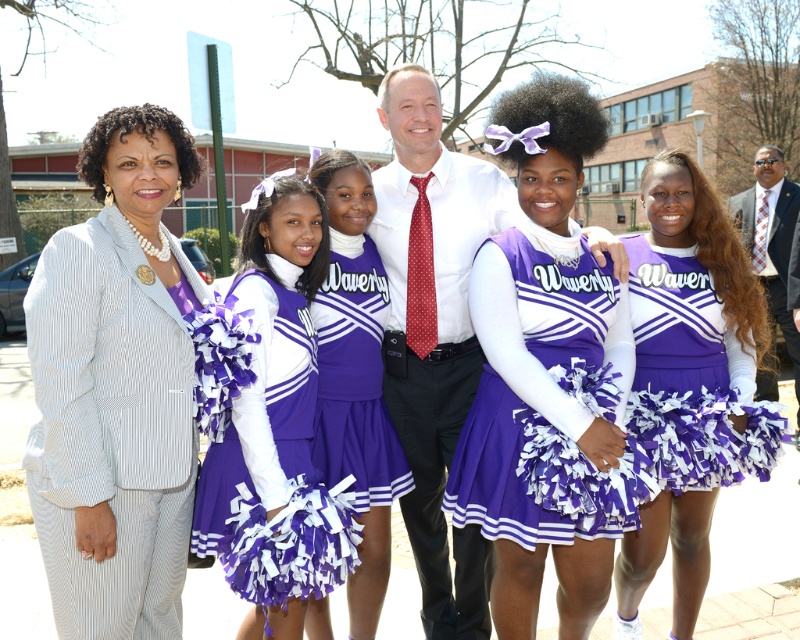
Question: Among these objects, which one is nearest to the camera?

Choices:
 (A) purple satin cheerleader at center
 (B) purple satin cheerleading outfit at center
 (C) purple fabric pom-poms at center
 (D) polished white shirt at center

Answer: (C)

Question: Which point is farther to the camera?

Choices:
 (A) (396, 294)
 (B) (308, 616)

Answer: (A)

Question: Does polished white shirt at center appear over polished wood tie at right?

Choices:
 (A) yes
 (B) no

Answer: (B)

Question: Among these points, which one is nearest to the camera?

Choices:
 (A) (300, 269)
 (B) (796, 332)

Answer: (A)

Question: Is polished white shirt at center bigger than purple satin cheerleader at center?

Choices:
 (A) yes
 (B) no

Answer: (A)

Question: Is the position of polished white shirt at center more distant than that of polished wood tie at right?

Choices:
 (A) yes
 (B) no

Answer: (B)